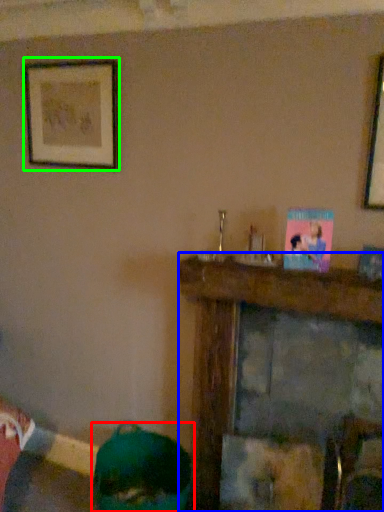
Question: Which object is positioned closest to person (highlighted by a red box)? Select from furniture (highlighted by a blue box) and picture frame (highlighted by a green box).

Choices:
 (A) furniture
 (B) picture frame

Answer: (A)